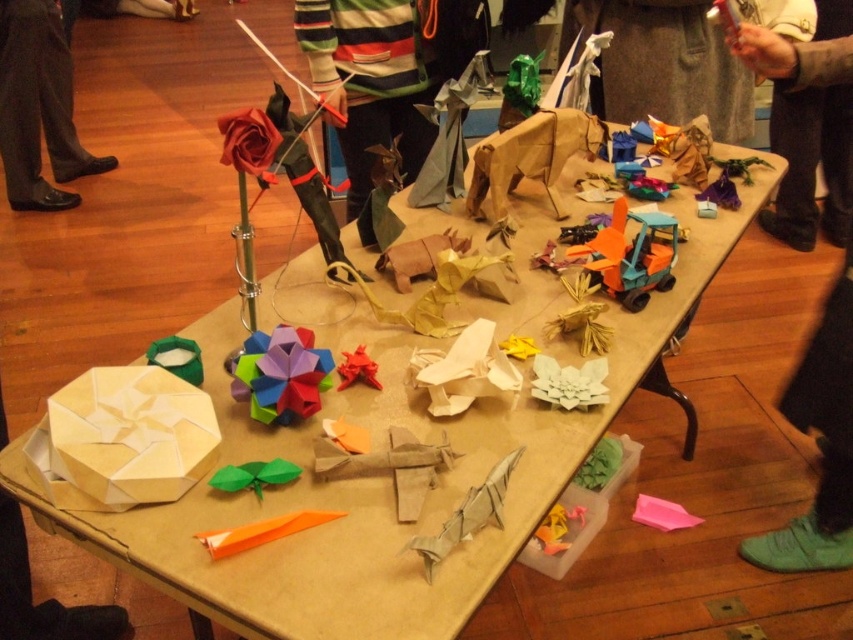
Question: Does green paper butterfly at center appear on the left side of rubberized plastic origami star at center?

Choices:
 (A) yes
 (B) no

Answer: (A)

Question: Does brown leather jacket at upper right appear under green matte origami at center?

Choices:
 (A) yes
 (B) no

Answer: (B)

Question: Which object is farther from the camera taking this photo?

Choices:
 (A) green paper butterfly at center
 (B) striped sweater at upper center

Answer: (B)

Question: Which of the following is the farthest from the observer?

Choices:
 (A) (221, 472)
 (B) (184, 349)
 (C) (370, 369)
 (D) (276, 397)

Answer: (C)

Question: From the image, what is the correct spatial relationship of brown leather jacket at upper right in relation to orange paper airplane at lower right?

Choices:
 (A) below
 (B) above

Answer: (B)

Question: Which object is farther from the camera taking this photo?

Choices:
 (A) striped sweater at upper center
 (B) green fabric pants at lower right
 (C) rubberized plastic origami star at center

Answer: (B)